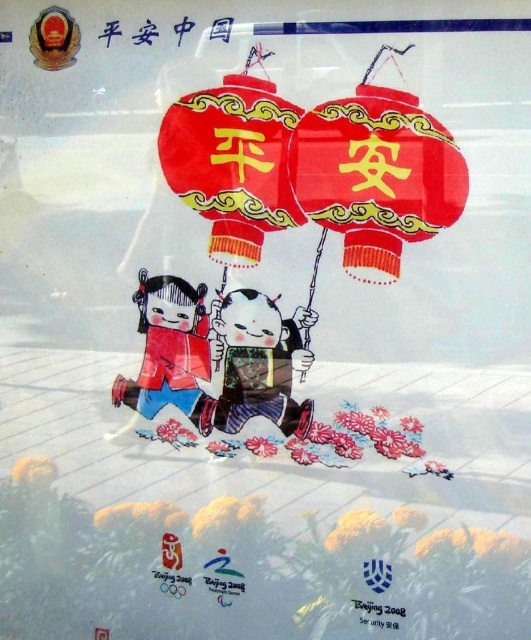
You are designing a display for an international cultural festival and need to arrange two items from the image. The silky fabric geisha at center and the black paper at lower right. Based on their sizes, which item should be placed in a more prominent position to attract attention?

The silky fabric geisha at center should be placed in a more prominent position since it is larger in size than the black paper at lower right, making it more noticeable to visitors.

In the scene shown: Based on the scene described, which object is positioned higher up in the image? The silky fabric geisha at center or the black paper at lower right?

The silky fabric geisha at center is located above the black paper at lower right.